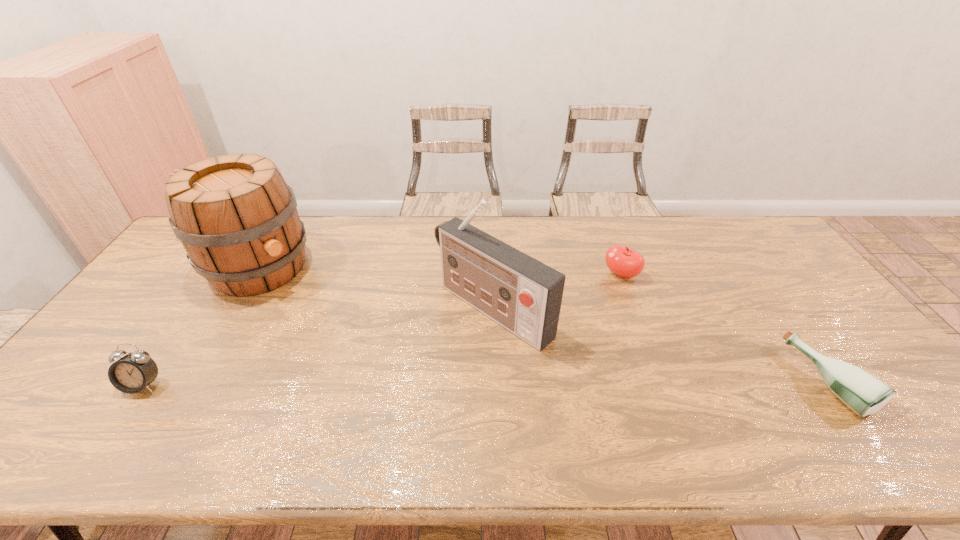
Locate an element on the screen. This screenshot has width=960, height=540. vacant space on the desktop that is between the alarm clock and the rightmost object and is positioned on the stem of the apple is located at coordinates (489, 383).

Identify the location of vacant space on the desktop that is between the alarm clock and the shortest object and is positioned on the side of the cider where the spigot is located. (407, 383).

Identify the location of vacant space on the desktop that is between the alarm clock and the shortest object and is positioned on the front panel of the radio receiver. The width and height of the screenshot is (960, 540). (397, 383).